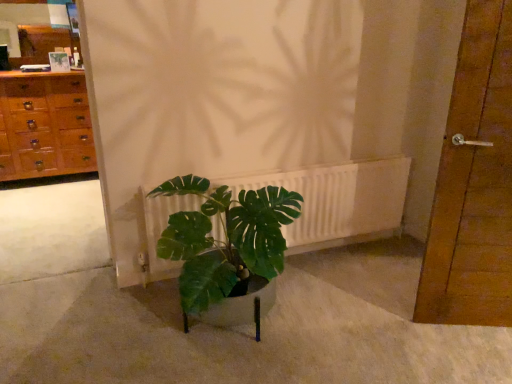
Question: Choose the correct answer: Is white matte radiator at center inside brown wooden door at right or outside it?

Choices:
 (A) inside
 (B) outside

Answer: (B)

Question: In terms of height, does white matte radiator at center look taller or shorter compared to brown wooden door at right?

Choices:
 (A) tall
 (B) short

Answer: (B)

Question: Estimate the real-world distances between objects in this image. Which object is closer to the white matte radiator at center?

Choices:
 (A) wooden chest of drawers at left
 (B) matte wooden mirror at upper left
 (C) brown wooden door at right

Answer: (C)

Question: Estimate the real-world distances between objects in this image. Which object is farther from the white matte radiator at center?

Choices:
 (A) wooden chest of drawers at left
 (B) matte wooden mirror at upper left
 (C) brown wooden door at right

Answer: (B)